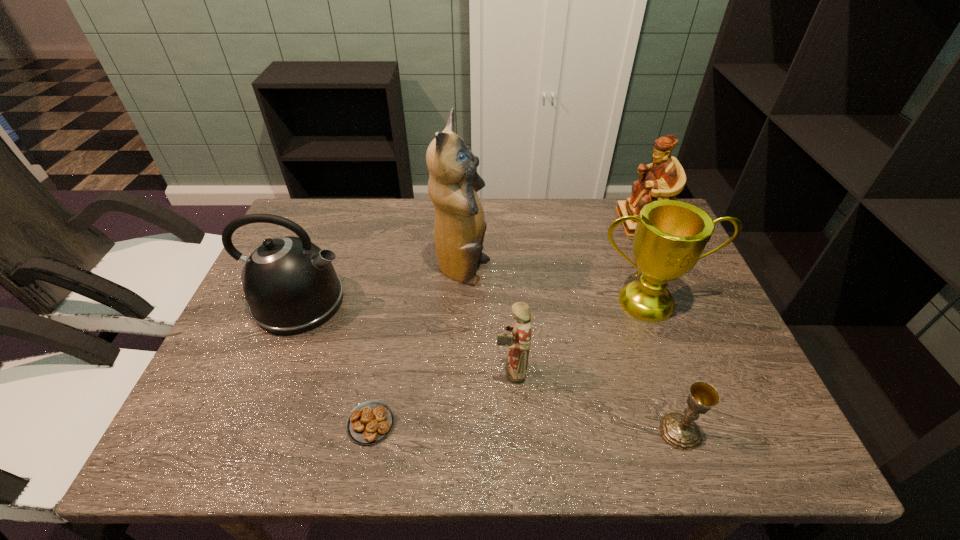
Locate an element on the screen. The height and width of the screenshot is (540, 960). free location located 0.140m on the left of the sixth tallest object is located at coordinates (589, 431).

Image resolution: width=960 pixels, height=540 pixels. What are the coordinates of `free space located on the right of the shortest object` in the screenshot? It's located at (577, 423).

The image size is (960, 540). Find the location of `object situated at the far edge`. object situated at the far edge is located at coordinates (665, 178).

What are the coordinates of `chalice that is at the near edge` in the screenshot? It's located at (680, 431).

Where is `pastry located in the near edge section of the desktop`? This screenshot has width=960, height=540. pastry located in the near edge section of the desktop is located at coordinates (370, 422).

Where is `object positioned at the left edge`? This screenshot has width=960, height=540. object positioned at the left edge is located at coordinates (290, 284).

Locate an element on the screen. The width and height of the screenshot is (960, 540). figurine that is at the right edge is located at coordinates (665, 178).

The height and width of the screenshot is (540, 960). In order to click on award that is at the right edge in this screenshot , I will do tap(670, 237).

Identify the location of chalice present at the right edge. tap(680, 431).

The width and height of the screenshot is (960, 540). I want to click on object that is positioned at the far right corner, so click(x=665, y=178).